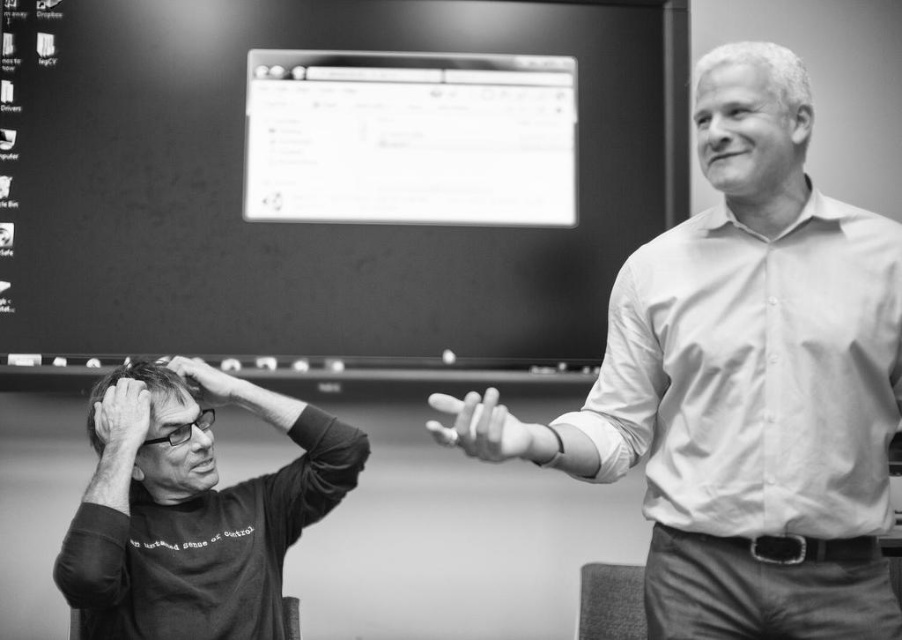
Looking at this image, in the scene described, there are two hands visible. The smooth skin hand at center and the matte black hand at lower left. Which hand is located to the right of the other?

The smooth skin hand at center is positioned to the right of the matte black hand at lower left.

You are a delivery person who needs to place a 32 inch box between the matte black monitor at upper center and the smooth skin head at left. Can the box fit between them without touching either object?

The distance between the matte black monitor at upper center and the smooth skin head at left is 33.12 inches. Since the box is 32 inches wide, there is 1.12 inches of space remaining. The box can fit between them without touching either object.